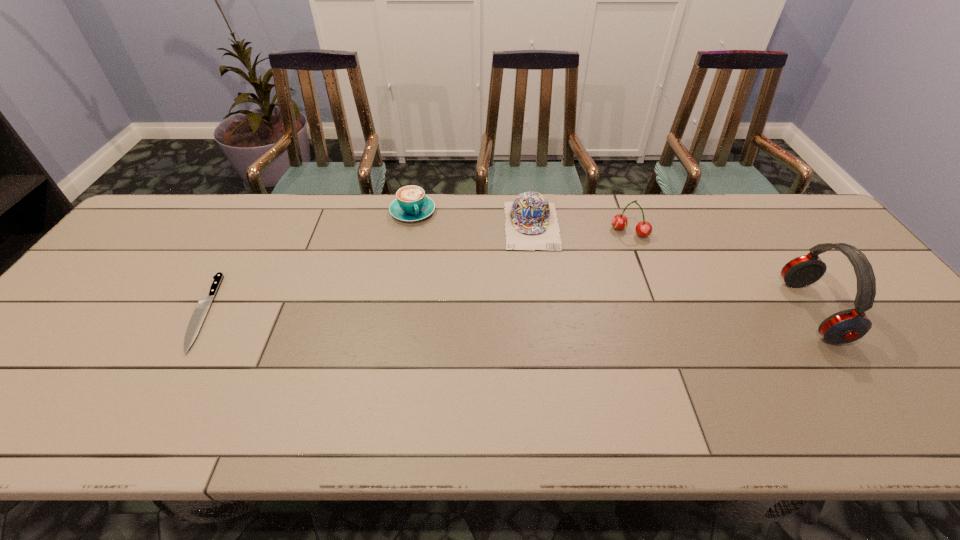
Find the location of a particular element. Image resolution: width=960 pixels, height=540 pixels. cappuccino that is at the far edge is located at coordinates (411, 204).

Where is `cap that is at the far edge`? The image size is (960, 540). cap that is at the far edge is located at coordinates (531, 222).

This screenshot has width=960, height=540. I want to click on object that is positioned at the right edge, so click(x=846, y=326).

Find the location of a particular element. vacant space at the far edge is located at coordinates (391, 202).

The image size is (960, 540). What are the coordinates of `free space at the near edge` in the screenshot? It's located at (683, 367).

This screenshot has width=960, height=540. In order to click on free region at the left edge of the desktop in this screenshot , I will do `click(82, 329)`.

This screenshot has height=540, width=960. I want to click on vacant space at the far right corner, so click(x=796, y=220).

Identify the location of free area in between the second object from right to left and the leftmost object. The image size is (960, 540). (417, 272).

Identify the location of empty location between the cappuccino and the tallest object. [612, 261].

This screenshot has width=960, height=540. Find the location of `empty location between the earphone and the cappuccino`. empty location between the earphone and the cappuccino is located at coordinates (612, 261).